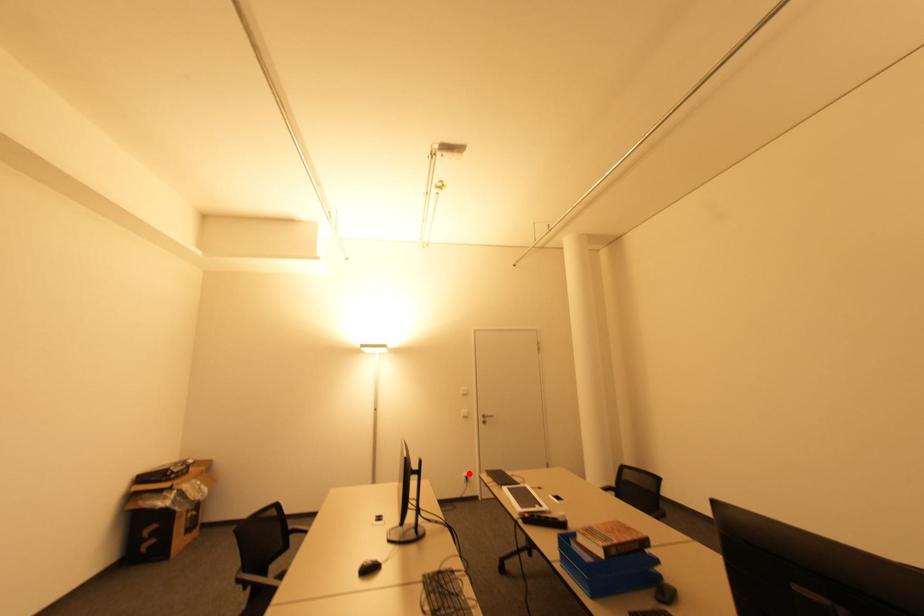
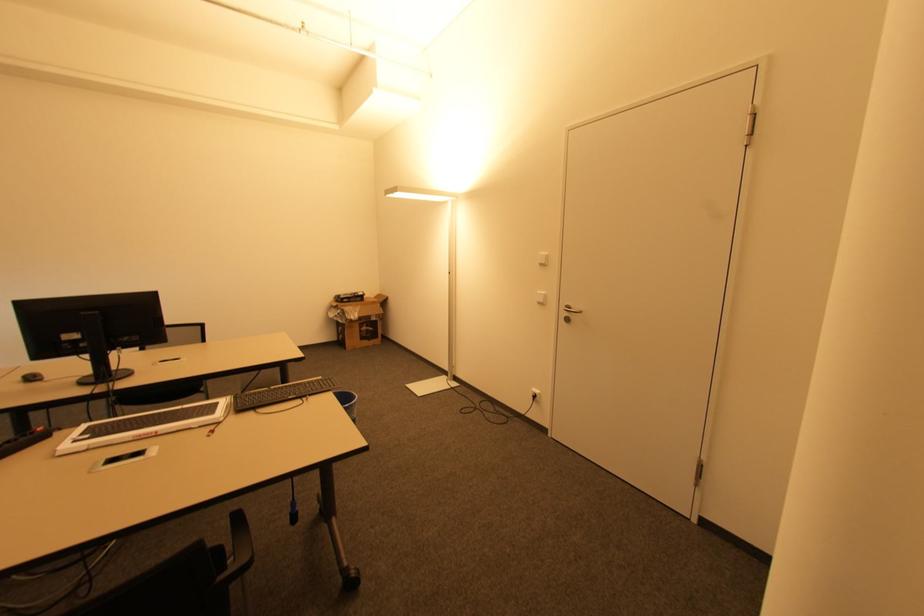
In the second image, find the point that corresponds to the highlighted location in the first image.

(539, 392)